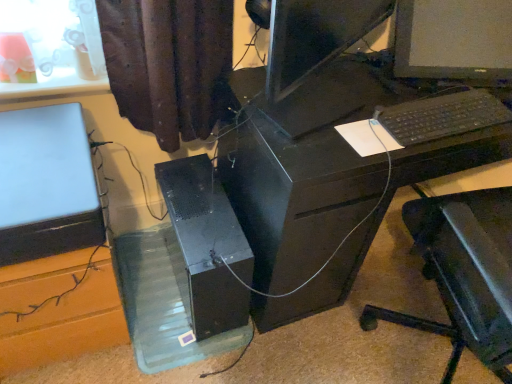
Identify the location of vacant space in transparent plastic glass box at lower center (from a real-world perspective). (151, 291).